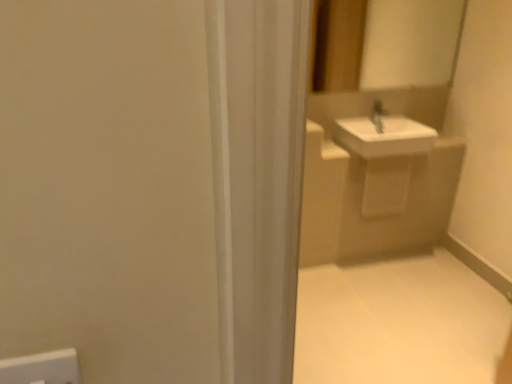
Question: Is white tile floor at lower right smaller than white glossy mirror at upper center?

Choices:
 (A) yes
 (B) no

Answer: (B)

Question: Does white tile floor at lower right have a larger size compared to white glossy mirror at upper center?

Choices:
 (A) no
 (B) yes

Answer: (B)

Question: Is the depth of white tile floor at lower right greater than that of white glossy mirror at upper center?

Choices:
 (A) yes
 (B) no

Answer: (B)

Question: From a real-world perspective, is white tile floor at lower right positioned over white glossy mirror at upper center based on gravity?

Choices:
 (A) no
 (B) yes

Answer: (A)

Question: Can you confirm if white tile floor at lower right is taller than white glossy mirror at upper center?

Choices:
 (A) yes
 (B) no

Answer: (B)

Question: Can you see white tile floor at lower right touching white glossy mirror at upper center?

Choices:
 (A) yes
 (B) no

Answer: (B)

Question: From the image's perspective, is white glossy mirror at upper center below white glossy sink at upper right?

Choices:
 (A) no
 (B) yes

Answer: (A)

Question: Is white glossy mirror at upper center positioned far away from white glossy sink at upper right?

Choices:
 (A) no
 (B) yes

Answer: (A)

Question: Is white glossy mirror at upper center positioned behind white glossy sink at upper right?

Choices:
 (A) no
 (B) yes

Answer: (A)

Question: Does white glossy mirror at upper center appear on the left side of white glossy sink at upper right?

Choices:
 (A) yes
 (B) no

Answer: (A)

Question: Can you confirm if white glossy mirror at upper center is thinner than white glossy sink at upper right?

Choices:
 (A) no
 (B) yes

Answer: (B)

Question: Does white glossy mirror at upper center turn towards white glossy sink at upper right?

Choices:
 (A) yes
 (B) no

Answer: (B)

Question: Can we say white glossy sink at upper right lies outside white tile floor at lower right?

Choices:
 (A) no
 (B) yes

Answer: (B)